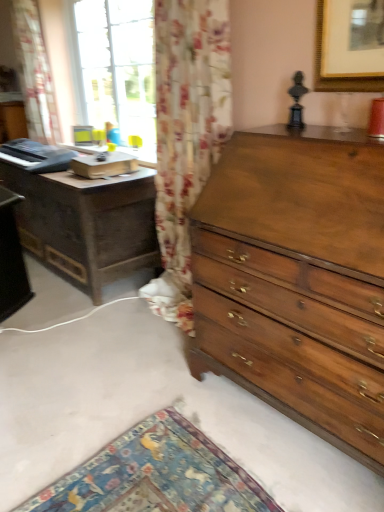
Question: Is shiny brown wood chest of drawers at right to the left of dark wood nightstand at left from the viewer's perspective?

Choices:
 (A) yes
 (B) no

Answer: (B)

Question: Can you confirm if shiny brown wood chest of drawers at right is thinner than dark wood nightstand at left?

Choices:
 (A) yes
 (B) no

Answer: (B)

Question: From the image's perspective, is shiny brown wood chest of drawers at right below dark wood nightstand at left?

Choices:
 (A) yes
 (B) no

Answer: (A)

Question: Is shiny brown wood chest of drawers at right oriented towards dark wood nightstand at left?

Choices:
 (A) no
 (B) yes

Answer: (A)

Question: Does shiny brown wood chest of drawers at right appear on the right side of dark wood nightstand at left?

Choices:
 (A) yes
 (B) no

Answer: (A)

Question: Is shiny brown wood chest of drawers at right touching dark wood nightstand at left?

Choices:
 (A) no
 (B) yes

Answer: (A)

Question: Is dark wood nightstand at left wider than floral fabric curtain at left?

Choices:
 (A) no
 (B) yes

Answer: (B)

Question: Considering the relative sizes of dark wood nightstand at left and floral fabric curtain at left in the image provided, is dark wood nightstand at left shorter than floral fabric curtain at left?

Choices:
 (A) no
 (B) yes

Answer: (B)

Question: Is dark wood nightstand at left beside floral fabric curtain at left?

Choices:
 (A) no
 (B) yes

Answer: (A)

Question: Is dark wood nightstand at left looking in the opposite direction of floral fabric curtain at left?

Choices:
 (A) no
 (B) yes

Answer: (A)

Question: Can you confirm if dark wood nightstand at left is smaller than floral fabric curtain at left?

Choices:
 (A) no
 (B) yes

Answer: (A)

Question: From a real-world perspective, does dark wood nightstand at left sit lower than floral fabric curtain at left?

Choices:
 (A) yes
 (B) no

Answer: (A)

Question: Does floral fabric curtain at left turn towards dark wood nightstand at left?

Choices:
 (A) yes
 (B) no

Answer: (B)